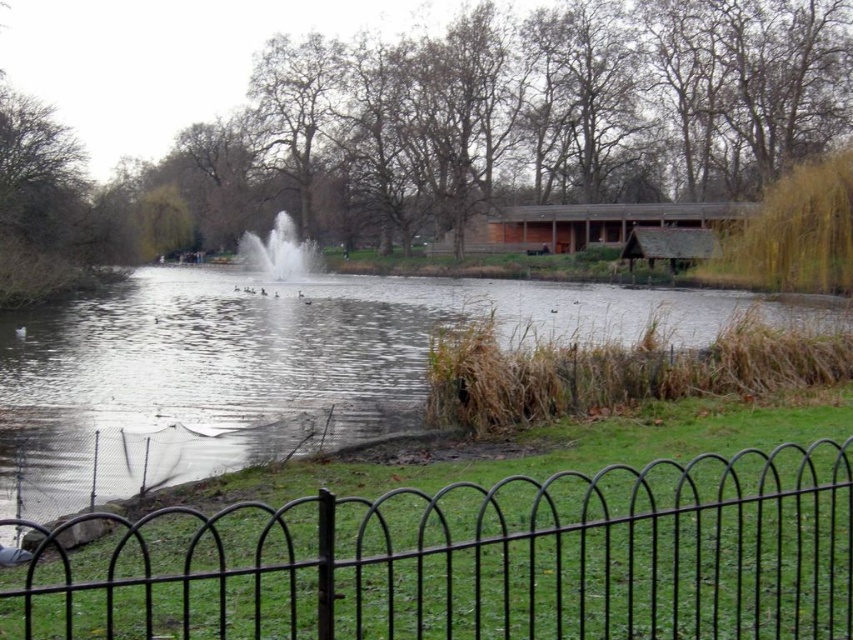
Question: Is clear water at center to the right of white frothy water at center from the viewer's perspective?

Choices:
 (A) no
 (B) yes

Answer: (B)

Question: Is black metal fence at lower center wider than clear water at center?

Choices:
 (A) yes
 (B) no

Answer: (B)

Question: Among these points, which one is farthest from the camera?

Choices:
 (A) (155, 456)
 (B) (161, 628)
 (C) (280, 250)

Answer: (C)

Question: Which of the following is the closest to the observer?

Choices:
 (A) black metal fence at lower center
 (B) clear water at center
 (C) white frothy water at center

Answer: (A)

Question: Among these objects, which one is nearest to the camera?

Choices:
 (A) black metal fence at lower center
 (B) clear water at center

Answer: (A)

Question: From the image, what is the correct spatial relationship of black metal fence at lower center in relation to clear water at center?

Choices:
 (A) right
 (B) left

Answer: (A)